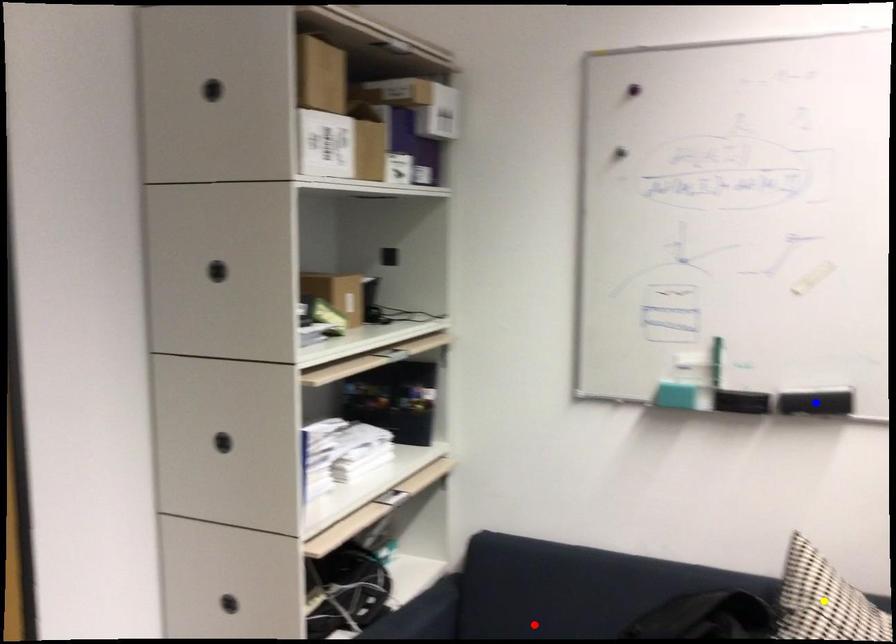
Order these from nearest to farthest:
1. red point
2. yellow point
3. blue point

yellow point < blue point < red point